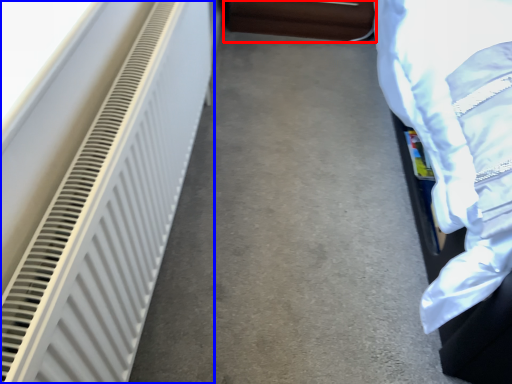
Question: Among these objects, which one is nearest to the camera, furniture (highlighted by a red box) or radiator (highlighted by a blue box)?

Choices:
 (A) furniture
 (B) radiator

Answer: (B)